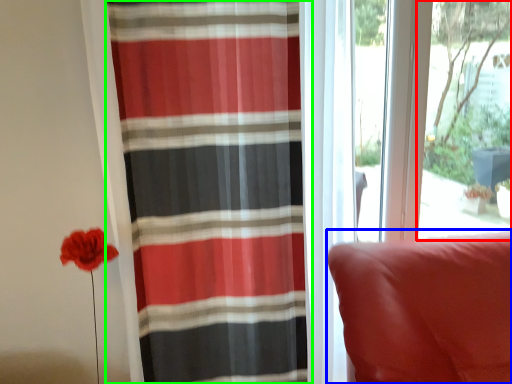
Question: Considering the real-world distances, which object is farthest from window screen (highlighted by a red box)? furniture (highlighted by a blue box) or curtain (highlighted by a green box)?

Choices:
 (A) furniture
 (B) curtain

Answer: (B)